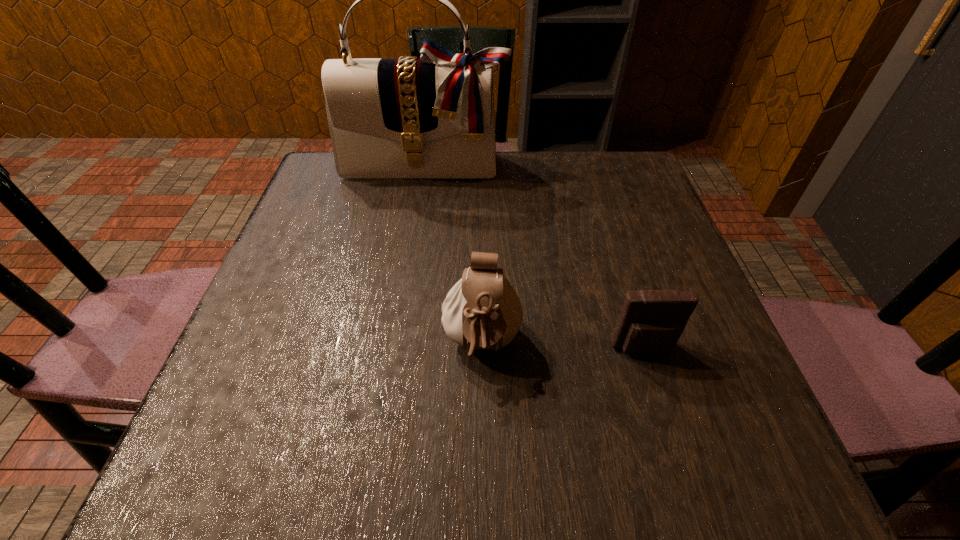
The image size is (960, 540). Find the location of `the tallest object`. the tallest object is located at coordinates (433, 117).

The width and height of the screenshot is (960, 540). In order to click on satchel in this screenshot , I will do `click(433, 117)`.

The image size is (960, 540). Find the location of `the second shortest object`. the second shortest object is located at coordinates (482, 311).

In order to click on the taller pouch in this screenshot , I will do `click(482, 311)`.

You are a GUI agent. You are given a task and a screenshot of the screen. Output one action in this format:
    pyautogui.click(x=<x>, y=<y>)
    Task: Click on the shorter pouch
    The image size is (960, 540).
    Given the screenshot: What is the action you would take?
    pyautogui.click(x=651, y=322)

Find the location of a particular element. The height and width of the screenshot is (540, 960). the right pouch is located at coordinates (651, 322).

Image resolution: width=960 pixels, height=540 pixels. I want to click on vacant space located on the front-facing side of the satchel, so click(410, 259).

Where is `vacant area situated 0.090m on the front-facing side of the taller pouch`? vacant area situated 0.090m on the front-facing side of the taller pouch is located at coordinates (483, 440).

This screenshot has height=540, width=960. I want to click on vacant area situated 0.140m with an open flap on the shorter pouch, so click(x=671, y=441).

Identify the location of object located at the far edge. (433, 117).